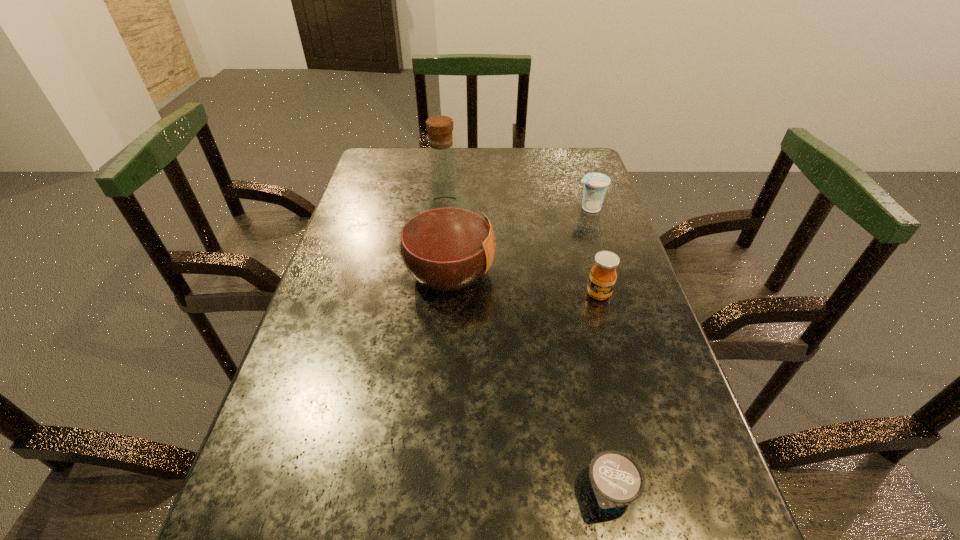
Locate an element on the screen. The width and height of the screenshot is (960, 540). vacant area between the honey and the nearer yogurt is located at coordinates (605, 393).

Find the location of a particular element. vacant area between the honey and the tallest object is located at coordinates (524, 283).

Locate an element on the screen. The width and height of the screenshot is (960, 540). vacant point located between the leftmost object and the honey is located at coordinates [524, 283].

The height and width of the screenshot is (540, 960). Find the location of `free space that is in between the leftmost object and the farthest object`. free space that is in between the leftmost object and the farthest object is located at coordinates (519, 240).

Locate an element on the screen. The image size is (960, 540). vacant space in between the honey and the left yogurt is located at coordinates (605, 393).

The width and height of the screenshot is (960, 540). What are the coordinates of `free space between the farthest object and the tallest object` in the screenshot? It's located at (519, 240).

Locate an element on the screen. Image resolution: width=960 pixels, height=540 pixels. object that is the second nearest to the shorter yogurt is located at coordinates (446, 244).

I want to click on object that stands as the third closest to the honey, so click(x=616, y=480).

Identify the location of free space that satisfies the following two spatial constraints: 1. on the front label of the liquor; 2. on the back side of the left yogurt. (433, 491).

Image resolution: width=960 pixels, height=540 pixels. What are the coordinates of `free spot that satisfies the following two spatial constraints: 1. on the back side of the nearer yogurt; 2. on the front label of the tallest object` in the screenshot? It's located at (565, 272).